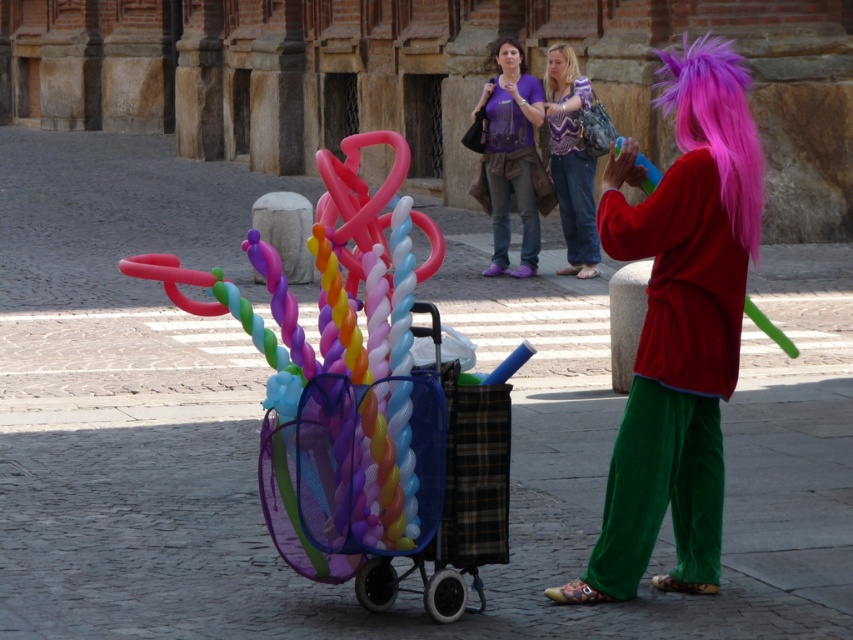
Does purple matte shirt at center have a greater width compared to pink synthetic wig at upper center?

Yes.

The image size is (853, 640). What do you see at coordinates (511, 156) in the screenshot?
I see `purple matte shirt at center` at bounding box center [511, 156].

Identify the location of purple matte shirt at center. This screenshot has height=640, width=853. (511, 156).

Is velvet red jacket at center to the left of pink synthetic wig at upper center from the viewer's perspective?

Correct, you'll find velvet red jacket at center to the left of pink synthetic wig at upper center.

Can you confirm if velvet red jacket at center is positioned to the right of pink synthetic wig at upper center?

Incorrect, velvet red jacket at center is not on the right side of pink synthetic wig at upper center.

Is point (630, 460) less distant than point (561, 44)?

Yes, it is.

The image size is (853, 640). Find the location of `velvet red jacket at center`. velvet red jacket at center is located at coordinates (679, 326).

Who is higher up, striped fabric shirt at center or purple silky hair at upper center?

Positioned higher is purple silky hair at upper center.

Is point (577, 237) less distant than point (498, 38)?

Yes, point (577, 237) is closer to viewer.

This screenshot has height=640, width=853. Find the location of `striped fabric shirt at center`. striped fabric shirt at center is located at coordinates (572, 161).